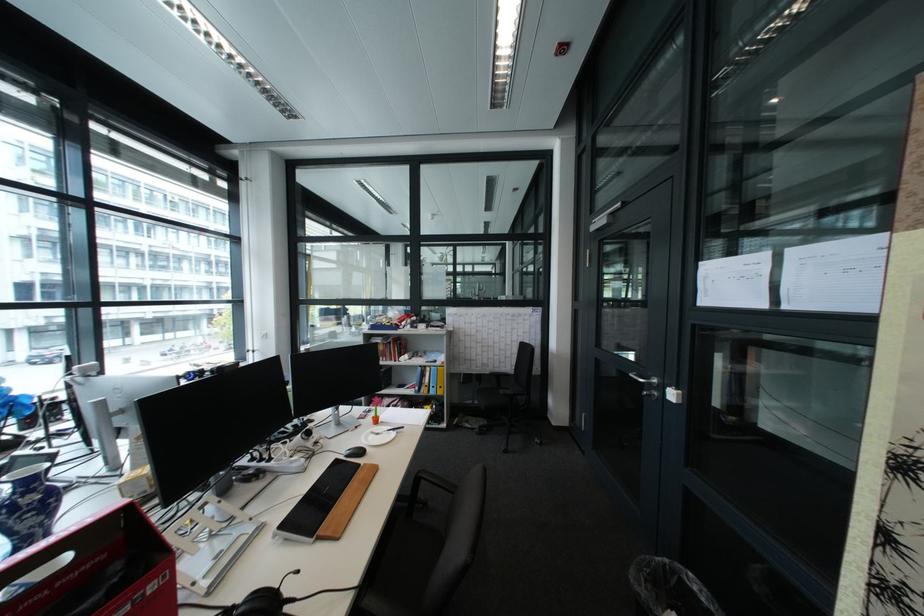
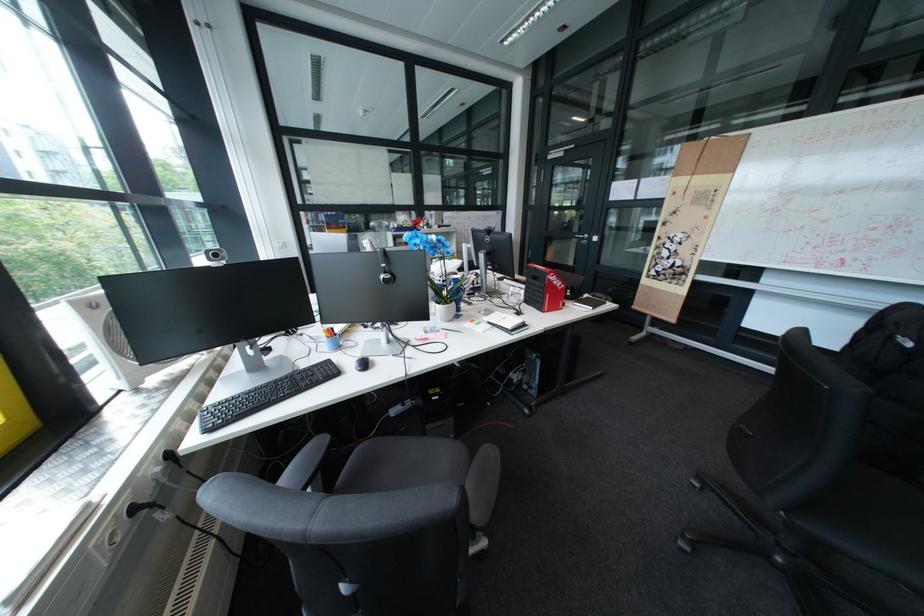
In the second image, find the point that corresponds to point 662,395 in the first image.

(598, 243)